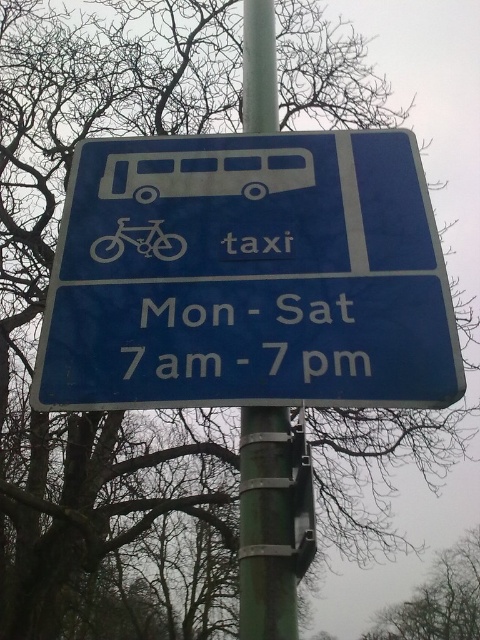
Is blue plastic sign at center positioned before white text at center?

Yes.

Who is taller, blue plastic sign at center or white text at center?

With more height is blue plastic sign at center.

Which is in front, point (381, 228) or point (256, 310)?

Point (256, 310) is in front.

You are a GUI agent. You are given a task and a screenshot of the screen. Output one action in this format:
    pyautogui.click(x=<x>, y=<y>)
    Task: Click on the blue plastic sign at center
    This screenshot has width=480, height=640.
    Given the screenshot: What is the action you would take?
    pyautogui.click(x=251, y=276)

Looking at this image, is green metallic pole at center thinner than matte silver bicycle at center?

Yes, green metallic pole at center is thinner than matte silver bicycle at center.

Is green metallic pole at center positioned before matte silver bicycle at center?

That is False.

Between point (275, 131) and point (97, 237), which one is positioned behind?

Positioned behind is point (275, 131).

Where is `green metallic pole at center`? This screenshot has width=480, height=640. green metallic pole at center is located at coordinates (265, 525).

Between blue plastic sign at center and matte silver bicycle at center, which one is positioned lower?

blue plastic sign at center

Which is behind, point (187, 336) or point (165, 246)?

The point (165, 246) is behind.

Who is more distant from viewer, (201, 330) or (96, 252)?

Positioned behind is point (96, 252).

Find the location of a particular element. This screenshot has width=480, height=640. blue plastic sign at center is located at coordinates (251, 276).